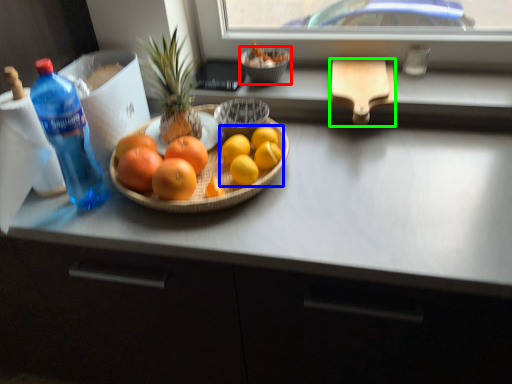
Question: Estimate the real-world distances between objects in this image. Which object is closer to glass bowl (highlighted by a red box), grapefruit (highlighted by a blue box) or cutting board (highlighted by a green box)?

Choices:
 (A) grapefruit
 (B) cutting board

Answer: (B)